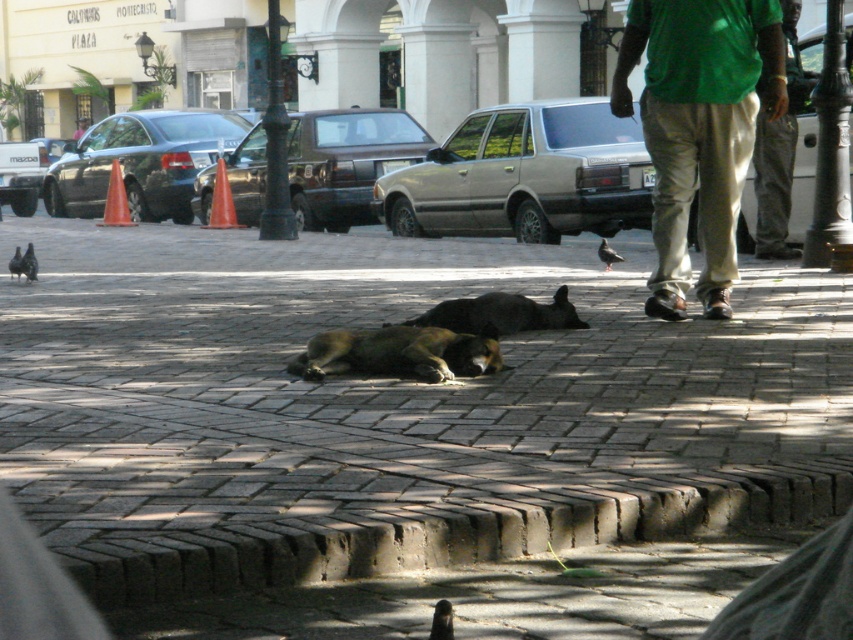
Can you confirm if brick pavement at center is positioned above brown fur dog at center?

Yes, brick pavement at center is above brown fur dog at center.

Which of these two, brick pavement at center or brown fur dog at center, stands taller?

Standing taller between the two is brick pavement at center.

Does point (500, 268) lie in front of point (352, 371)?

No, it is not.

Locate an element on the screen. brick pavement at center is located at coordinates (390, 406).

Is point (309, 275) positioned before point (438, 636)?

No, (309, 275) is further to viewer.

I want to click on brick pavement at center, so click(390, 406).

Is point (373, 154) positioned in front of point (62, 147)?

That is True.

Is dark brown metallic car at center bigger than shiny black sedan at left?

Actually, dark brown metallic car at center might be smaller than shiny black sedan at left.

This screenshot has height=640, width=853. What are the coordinates of `dark brown metallic car at center` in the screenshot? It's located at (346, 163).